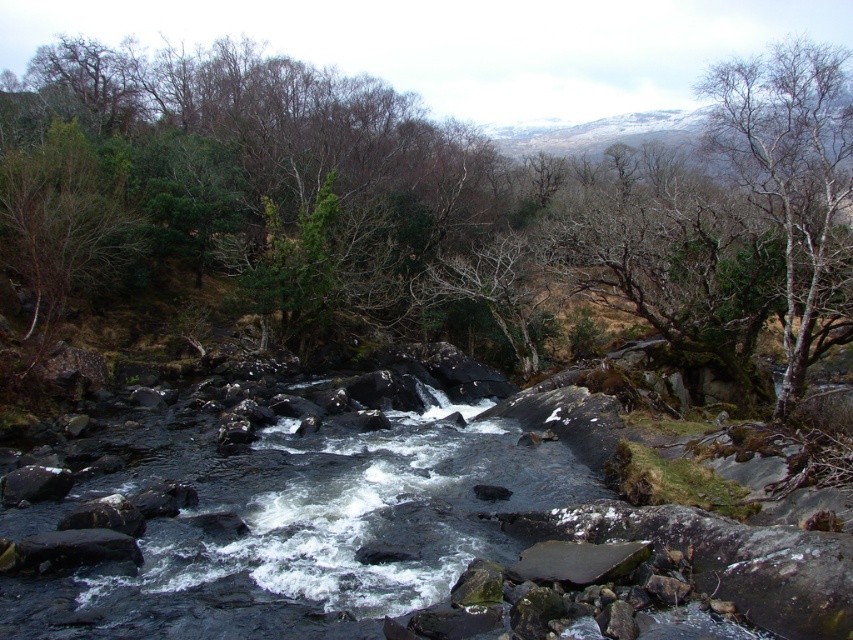
You are a hiker trying to cross the river. You notice a green leafy tree at center and a bare bark tree at upper right. Which tree would you choose to use as a landmark to navigate to the opposite bank?

The green leafy tree at center is positioned over the bare bark tree at upper right, so it would be a better landmark since it is closer to the river and more visible from the opposite bank.

You are an observer standing at the riverbank. You see the green leafy tree at center and the bare bark tree at upper right. Which tree is closer to you?

The green leafy tree at center is closer to you because the bare bark tree at upper right is behind it.